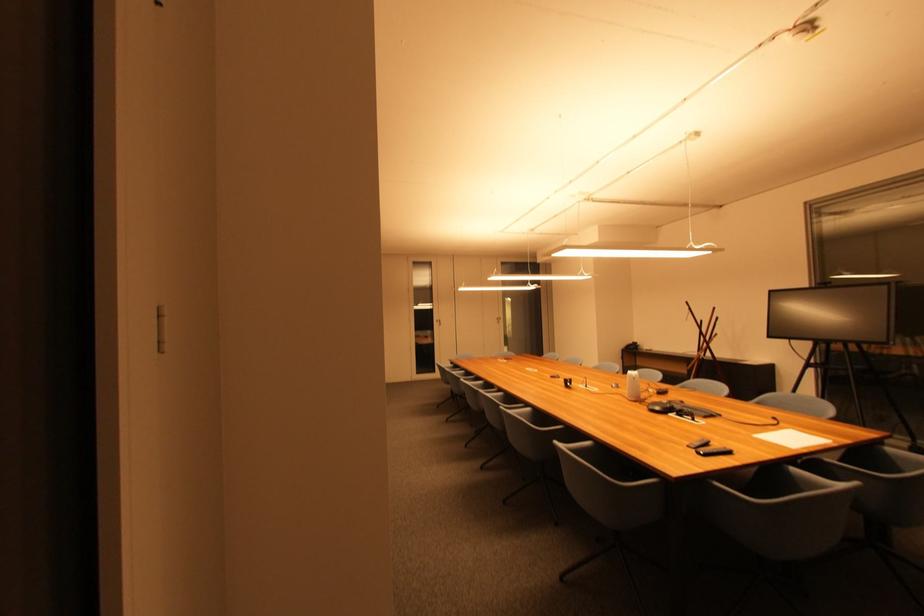
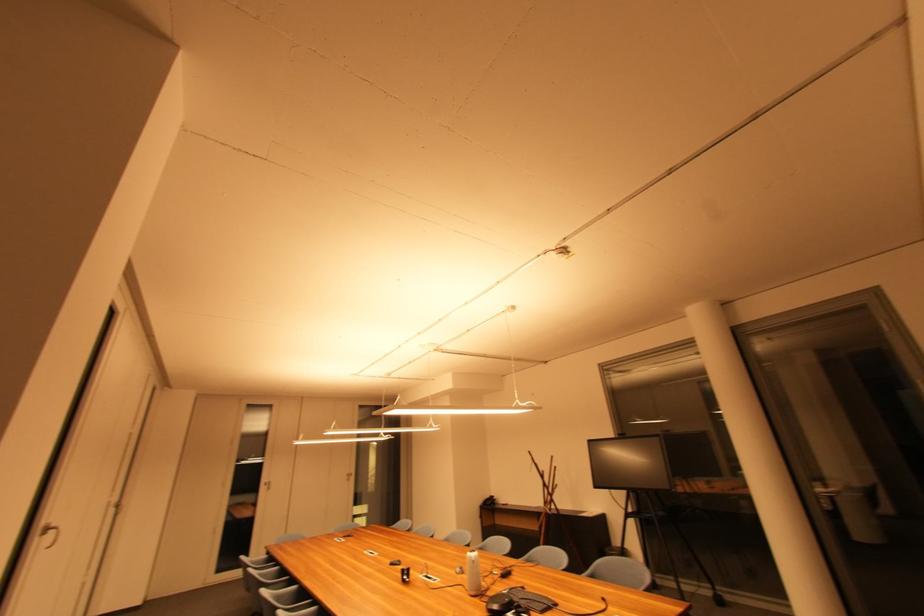
The point at (x=443, y=323) is marked in the first image. Where is the corresponding point in the second image?

(271, 485)